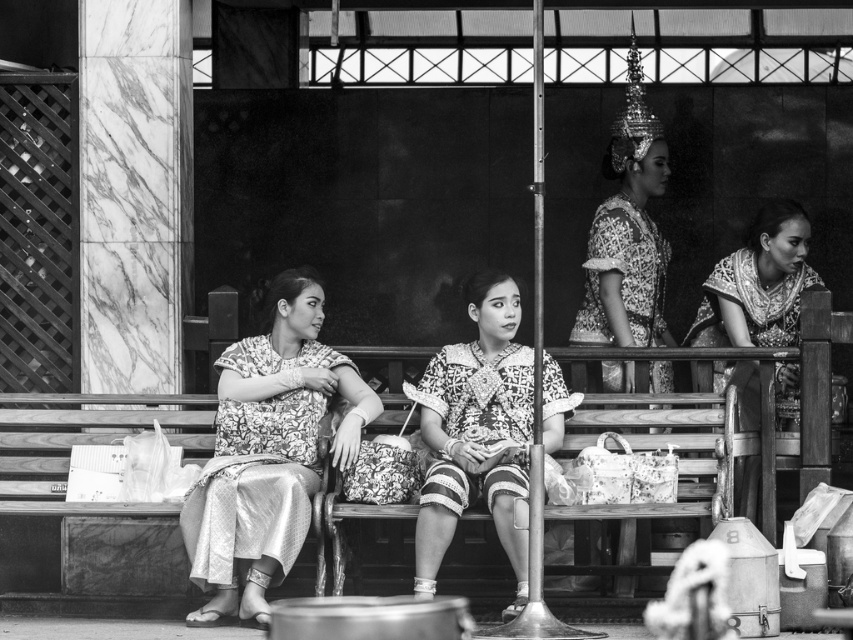
Question: Which point is farther from the camera taking this photo?

Choices:
 (A) coord(790,304)
 (B) coord(469,456)

Answer: (A)

Question: Does wooden bench at center appear over silky fabric dress at center?

Choices:
 (A) yes
 (B) no

Answer: (B)

Question: Among these points, which one is farthest from the camera?

Choices:
 (A) (780, 403)
 (B) (705, 465)
 (C) (426, 390)
 (D) (289, 493)

Answer: (A)

Question: Which object is the closest to the patterned fabric skirt at center?

Choices:
 (A) wooden bench at center
 (B) printed silk dress at center
 (C) silky fabric dress at center

Answer: (A)

Question: Observing the image, what is the correct spatial positioning of wooden bench at center in reference to patterned fabric skirt at center?

Choices:
 (A) left
 (B) right

Answer: (A)

Question: Can you confirm if wooden bench at center is thinner than patterned fabric skirt at center?

Choices:
 (A) no
 (B) yes

Answer: (A)